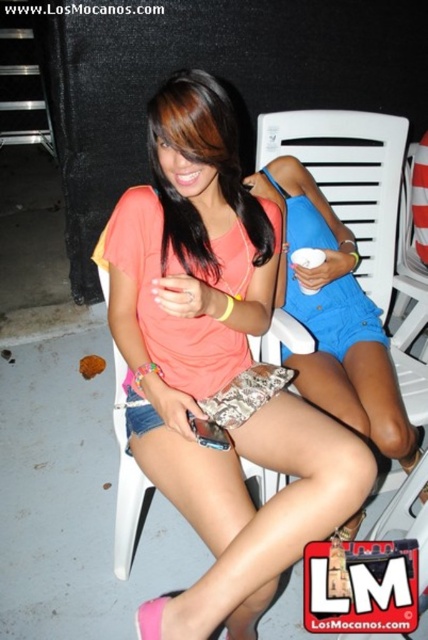
You are standing in front of two people wearing different tops. The first person is wearing a matte coral tank top at center and the second person is wearing a matte peach top at center. Which top is positioned more to the right?

The matte coral tank top at center is positioned more to the right than the matte peach top at center.

Based on the photo, you are an AI analyzing the positioning of clothing items in an image. The scene shows two people sitting on chairs at night. You need to determine the exact 2D coordinates of the matte coral tank top at center. What are its coordinates?

The matte coral tank top at center is located at the 2D coordinates point (216, 365).